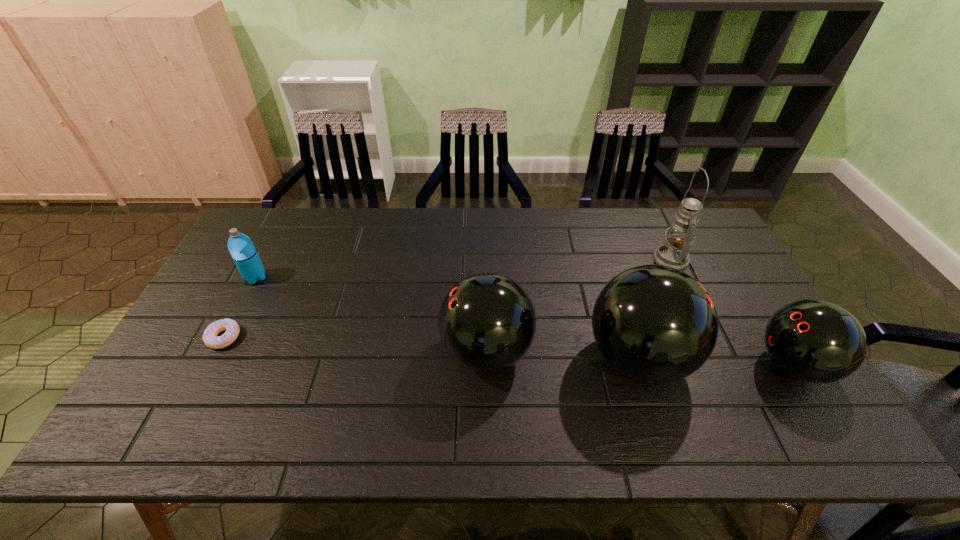
In the current image, all bowling balls are evenly spaced. To maintain this equal spacing, where should an additional bowling ball be placed on the left? Please point out a free spot. Please provide its 2D coordinates. Your answer should be formatted as a tuple, i.e. [(x, y)], where the tuple contains the x and y coordinates of a point satisfying the conditions above.

[(340, 345)]